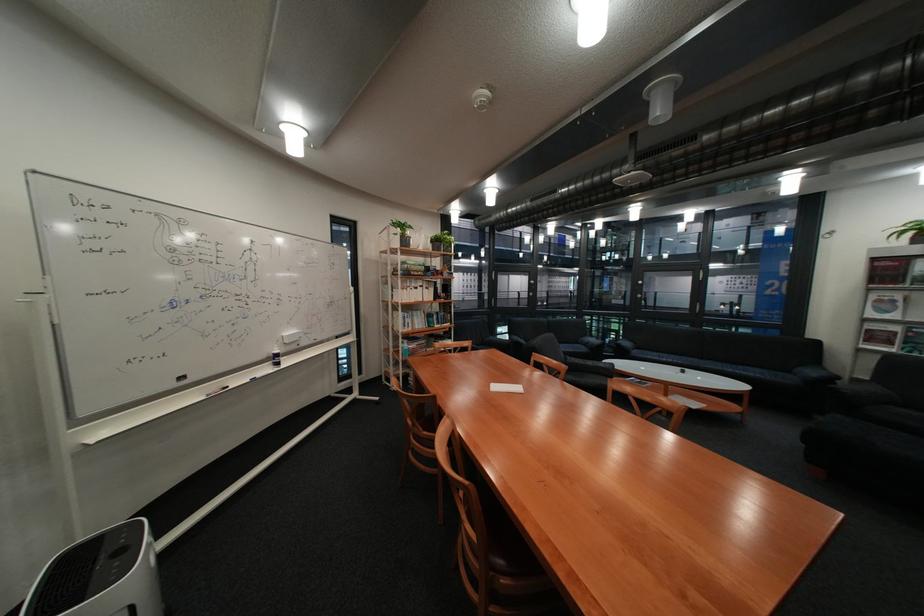
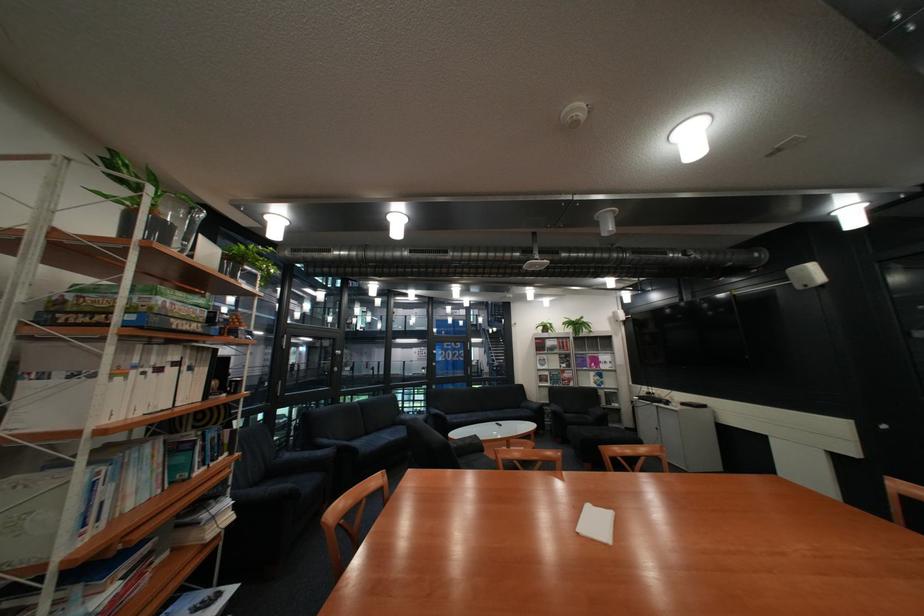
Find the pixel in the second image that matches point (614, 293) in the first image.

(344, 365)